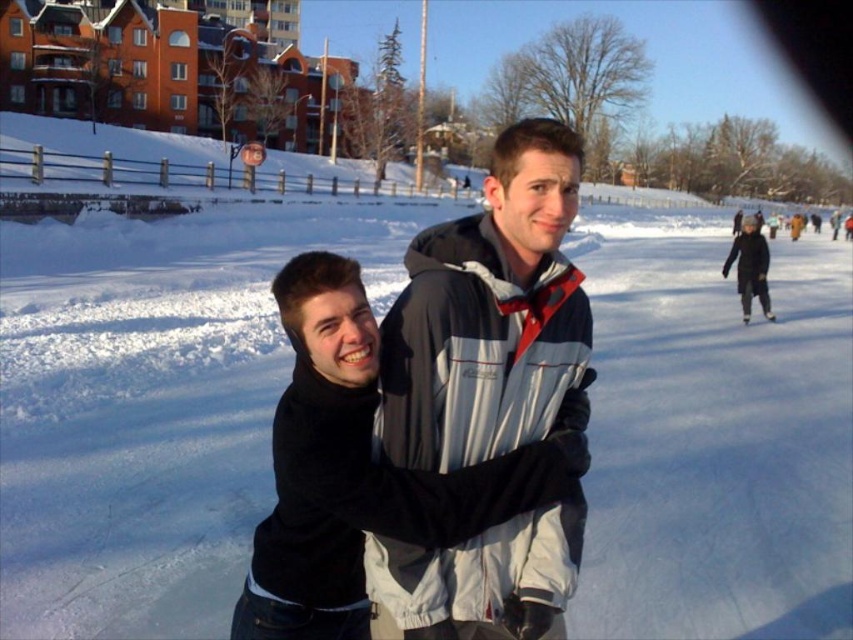
Question: Among these objects, which one is nearest to the camera?

Choices:
 (A) gray/white jacket at center
 (B) black woolen jacket at upper right

Answer: (A)

Question: Which point appears closest to the camera in this image?

Choices:
 (A) (741, 282)
 (B) (488, 628)

Answer: (B)

Question: Does gray/white jacket at center appear on the left side of black woolen jacket at upper right?

Choices:
 (A) no
 (B) yes

Answer: (B)

Question: Is gray/white jacket at center wider than black woolen jacket at upper right?

Choices:
 (A) no
 (B) yes

Answer: (A)

Question: Does gray/white jacket at center have a lesser width compared to black woolen jacket at upper right?

Choices:
 (A) no
 (B) yes

Answer: (B)